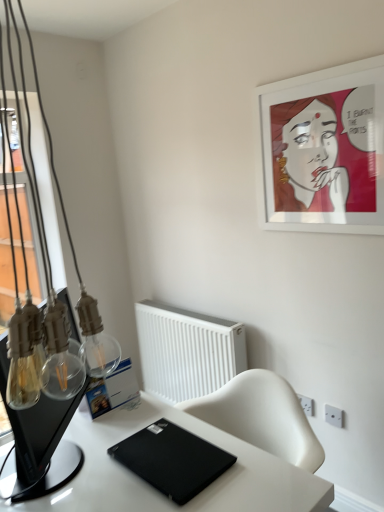
What do you see at coordinates (187, 351) in the screenshot? The image size is (384, 512). I see `white plastic radiator at center` at bounding box center [187, 351].

This screenshot has width=384, height=512. Find the location of `black matte laptop at lower center`. black matte laptop at lower center is located at coordinates (172, 459).

Would you say white glossy desk at center is to the left or to the right of black matte laptop at lower center in the picture?

In the image, white glossy desk at center appears on the right side of black matte laptop at lower center.

Between white glossy desk at center and black matte laptop at lower center, which one has larger size?

white glossy desk at center is bigger.

In the image, there is a black matte laptop at lower center. Identify the location of desk below it (from a real-world perspective). The width and height of the screenshot is (384, 512). (158, 490).

Is white glossy desk at center inside or outside of black matte laptop at lower center?

white glossy desk at center exists outside the volume of black matte laptop at lower center.

Is transparent glass monitor at left positioned behind white plastic radiator at center?

That is False.

Considering the relative sizes of transparent glass monitor at left and white plastic radiator at center in the image provided, is transparent glass monitor at left smaller than white plastic radiator at center?

Yes.

Locate an element on the screen. Image resolution: width=384 pixels, height=512 pixels. computer monitor located above the white plastic radiator at center (from a real-world perspective) is located at coordinates (41, 439).

From the image's perspective, is transparent glass monitor at left above white plastic radiator at center?

Indeed, from the image's perspective, transparent glass monitor at left is shown above white plastic radiator at center.

From a real-world perspective, which is physically below, transparent glass monitor at left or white glossy desk at center?

In real-world perspective, white glossy desk at center is lower.

Looking at the image, does transparent glass monitor at left seem bigger or smaller compared to white glossy desk at center?

Considering their sizes, transparent glass monitor at left takes up less space than white glossy desk at center.

Considering the relative positions of transparent glass monitor at left and white glossy desk at center in the image provided, is transparent glass monitor at left to the right of white glossy desk at center from the viewer's perspective?

No.

From a real-world perspective, is black matte laptop at lower center physically located above or below white matte picture frame at upper right?

Clearly, from a real-world perspective, black matte laptop at lower center is below white matte picture frame at upper right.

Relative to white matte picture frame at upper right, is black matte laptop at lower center in front or behind?

Clearly, black matte laptop at lower center is in front of white matte picture frame at upper right.

Is black matte laptop at lower center outside of white matte picture frame at upper right?

black matte laptop at lower center is positioned outside white matte picture frame at upper right.

Considering the relative positions of black matte laptop at lower center and white matte picture frame at upper right in the image provided, is black matte laptop at lower center to the left of white matte picture frame at upper right from the viewer's perspective?

Yes, black matte laptop at lower center is to the left of white matte picture frame at upper right.

Does white matte picture frame at upper right turn towards white plastic radiator at center?

No, white matte picture frame at upper right is not aimed at white plastic radiator at center.

Are white matte picture frame at upper right and white plastic radiator at center far apart?

No, there isn't a large distance between white matte picture frame at upper right and white plastic radiator at center.

Considering the sizes of white matte picture frame at upper right and white plastic radiator at center in the image, is white matte picture frame at upper right wider or thinner than white plastic radiator at center?

Considering their sizes, white matte picture frame at upper right looks slimmer than white plastic radiator at center.

Which of these two, white matte picture frame at upper right or white plastic radiator at center, is bigger?

white plastic radiator at center.

Would you say white glossy desk at center is inside or outside white plastic radiator at center?

white glossy desk at center is not enclosed by white plastic radiator at center.

In the scene shown: Considering the relative sizes of white glossy desk at center and white plastic radiator at center in the image provided, is white glossy desk at center shorter than white plastic radiator at center?

No, white glossy desk at center is not shorter than white plastic radiator at center.

Is white glossy desk at center oriented towards white plastic radiator at center?

No, white glossy desk at center does not turn towards white plastic radiator at center.

From the image's perspective, is white glossy desk at center below white plastic radiator at center?

Yes, from the image's perspective, white glossy desk at center is below white plastic radiator at center.

Does white glossy desk at center contain transparent glass monitor at left?

No, transparent glass monitor at left is located outside of white glossy desk at center.

From a real-world perspective, which is physically below, white glossy desk at center or transparent glass monitor at left?

From a 3D spatial view, white glossy desk at center is below.

Identify the location of desk behind the transparent glass monitor at left. (158, 490).

Relative to transparent glass monitor at left, is white glossy desk at center in front or behind?

Visually, white glossy desk at center is located behind transparent glass monitor at left.

Locate an element on the screen. The height and width of the screenshot is (512, 384). desk below the black matte laptop at lower center (from a real-world perspective) is located at coordinates (158, 490).

You are a GUI agent. You are given a task and a screenshot of the screen. Output one action in this format:
    pyautogui.click(x=<x>, y=<y>)
    Task: Click on the radiator located behind the transparent glass monitor at left
    Image resolution: width=384 pixels, height=512 pixels.
    Given the screenshot: What is the action you would take?
    pyautogui.click(x=187, y=351)

Looking at the image, which one is located further to black matte laptop at lower center, white matte picture frame at upper right or transparent glass monitor at left?

Among the two, white matte picture frame at upper right is located further to black matte laptop at lower center.

When comparing their distances from transparent glass monitor at left, does white plastic radiator at center or black matte laptop at lower center seem further?

white plastic radiator at center.

Estimate the real-world distances between objects in this image. Which object is further from black matte laptop at lower center, white plastic radiator at center or white matte picture frame at upper right?

white matte picture frame at upper right lies further to black matte laptop at lower center than the other object.

When comparing their distances from white matte picture frame at upper right, does black matte laptop at lower center or white plastic radiator at center seem further?

black matte laptop at lower center is positioned further to the anchor white matte picture frame at upper right.

Looking at the image, which one is located closer to white glossy desk at center, black matte laptop at lower center or white plastic radiator at center?

Based on the image, black matte laptop at lower center appears to be nearer to white glossy desk at center.

Considering their positions, is transparent glass monitor at left positioned further to black matte laptop at lower center than white matte picture frame at upper right?

white matte picture frame at upper right is further to black matte laptop at lower center.

Estimate the real-world distances between objects in this image. Which object is closer to black matte laptop at lower center, transparent glass monitor at left or white glossy desk at center?

white glossy desk at center is positioned closer to the anchor black matte laptop at lower center.

Which object lies nearer to the anchor point transparent glass monitor at left, white glossy desk at center or black matte laptop at lower center?

white glossy desk at center lies closer to transparent glass monitor at left than the other object.

You are a GUI agent. You are given a task and a screenshot of the screen. Output one action in this format:
    pyautogui.click(x=<x>, y=<y>)
    Task: Click on the radiator between white matte picture frame at upper right and black matte laptop at lower center in the up-down direction
    
    Given the screenshot: What is the action you would take?
    click(187, 351)

The image size is (384, 512). I want to click on radiator between white matte picture frame at upper right and white glossy desk at center in the vertical direction, so click(187, 351).

What are the coordinates of `computer monitor that lies between white matte picture frame at upper right and white glossy desk at center from top to bottom` in the screenshot? It's located at (41, 439).

Identify the location of desk between transparent glass monitor at left and white plastic radiator at center along the z-axis. The image size is (384, 512). (158, 490).